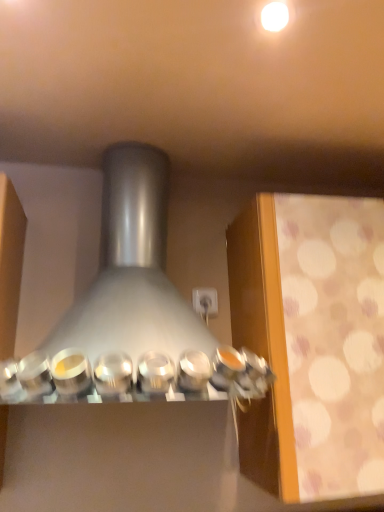
Find the location of a particular element. The height and width of the screenshot is (512, 384). vacant space to the right of white glossy light bulb at upper center is located at coordinates (333, 39).